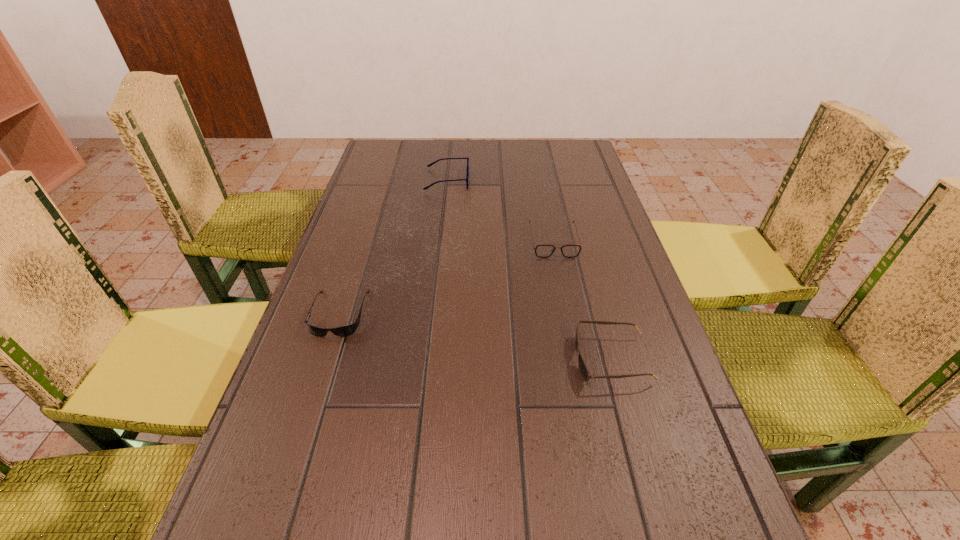
This screenshot has height=540, width=960. Find the location of `the third object from right to left`. the third object from right to left is located at coordinates (431, 164).

Where is `spectacles`? Image resolution: width=960 pixels, height=540 pixels. spectacles is located at coordinates (431, 164).

Locate an element on the screen. Image resolution: width=960 pixels, height=540 pixels. the farthest sunglasses is located at coordinates (543, 250).

Locate an element on the screen. the shortest object is located at coordinates (350, 329).

The image size is (960, 540). Identify the location of the shortest sunglasses. (350, 329).

The width and height of the screenshot is (960, 540). Identify the location of vacant space located 0.220m on the front-facing side of the farthest object. (539, 180).

Image resolution: width=960 pixels, height=540 pixels. Find the location of `free space located on the front-facing side of the third nearest object`. free space located on the front-facing side of the third nearest object is located at coordinates pos(580,369).

Find the location of a particular element. The height and width of the screenshot is (540, 960). free spot located on the front-facing side of the shortest object is located at coordinates (299, 438).

Locate an element on the screen. This screenshot has height=540, width=960. object that is at the far edge is located at coordinates (431, 164).

Locate an element on the screen. This screenshot has width=960, height=540. object that is at the left edge is located at coordinates (350, 329).